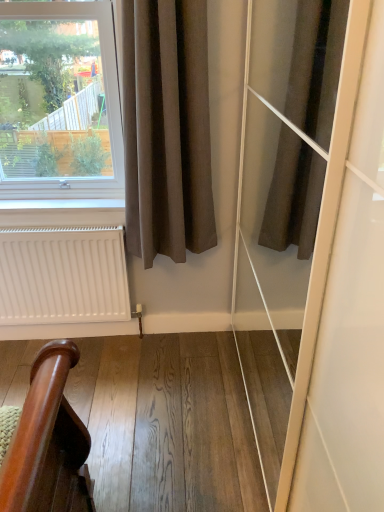
Find the location of `free point below brown cotton curtain at left (from a real-world perspective)`. free point below brown cotton curtain at left (from a real-world perspective) is located at coordinates (168, 346).